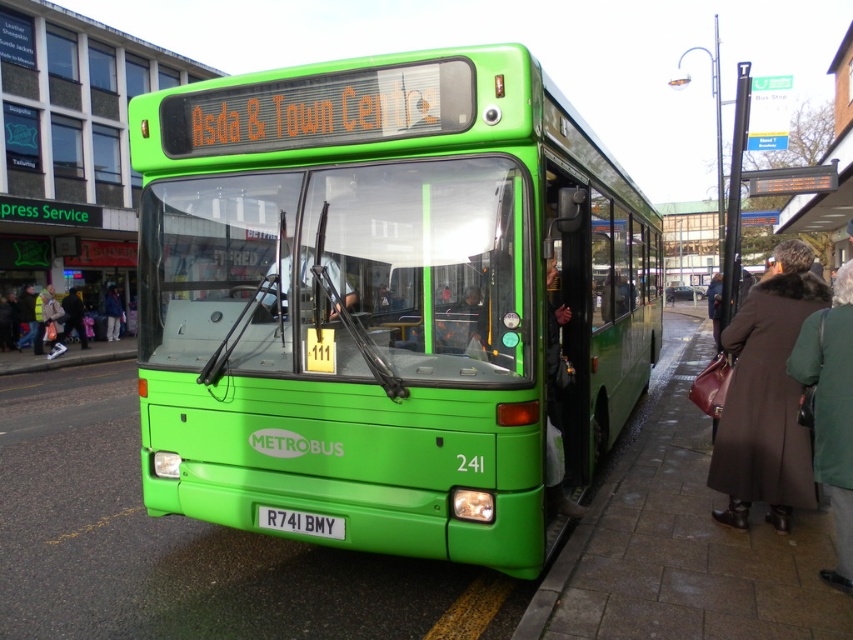
Measure the distance from green fabric coat at right to yellow reflective jacket at lower left.

green fabric coat at right and yellow reflective jacket at lower left are 20.23 meters apart from each other.

Can you confirm if green fabric coat at right is positioned below yellow reflective jacket at lower left?

Yes.

Which is behind, point (845, 268) or point (56, 344)?

The point (56, 344) is more distant.

The image size is (853, 640). What are the coordinates of `green fabric coat at right` in the screenshot? It's located at (831, 412).

Between point (782, 365) and point (274, 513), which one is positioned in front?

Point (274, 513)

Which is more to the right, brown fur coat at right or white plastic license plate at center?

brown fur coat at right is more to the right.

Identify the location of brown fur coat at right. [x=766, y=396].

Is green matte bus at center shorter than yellow reflective jacket at lower left?

Yes.

Is green matte bus at center bigger than yellow reflective jacket at lower left?

No, green matte bus at center is not bigger than yellow reflective jacket at lower left.

Find the location of a particular element. This screenshot has width=853, height=640. green matte bus at center is located at coordinates (386, 300).